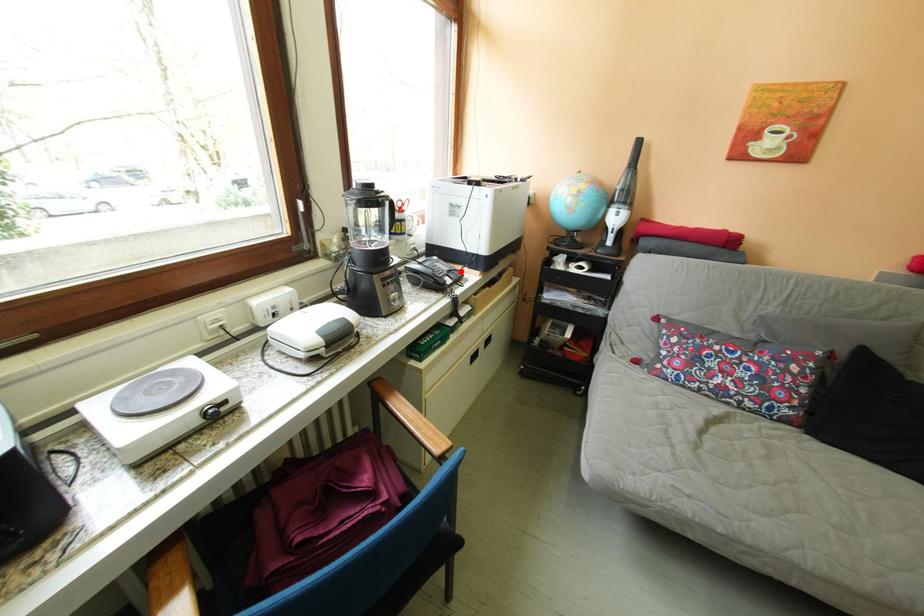
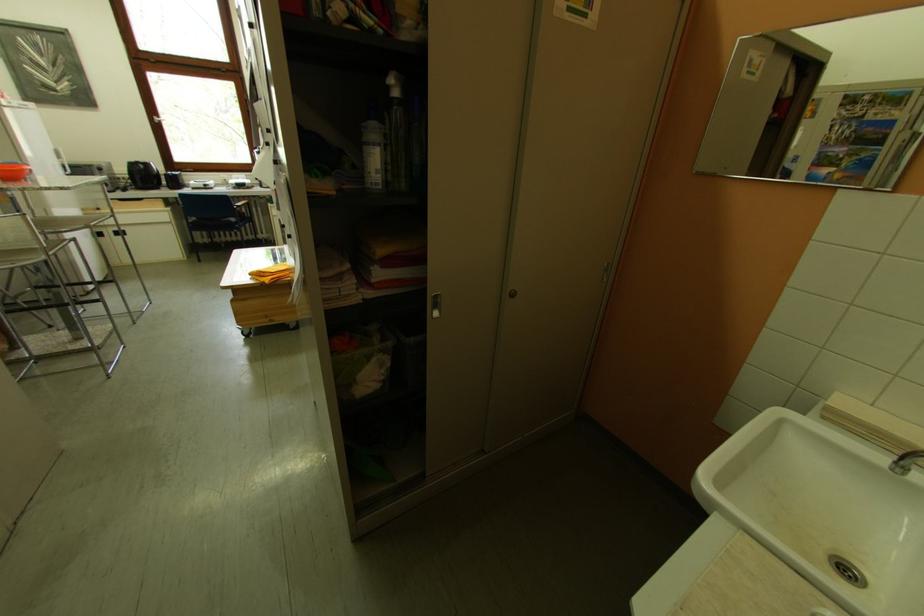
Question: I am providing you with two images of the same scene from different viewpoints. A red point is marked on the first image. Can you still see the location of the red point in image 2?

Choices:
 (A) Yes
 (B) No

Answer: (B)